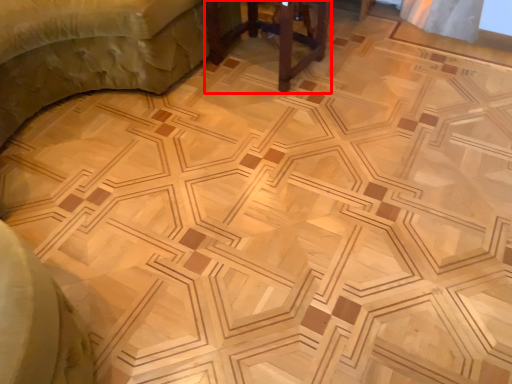
Question: Observing the image, what is the correct spatial positioning of furniture (annotated by the red box) in reference to furniture?

Choices:
 (A) right
 (B) left

Answer: (A)